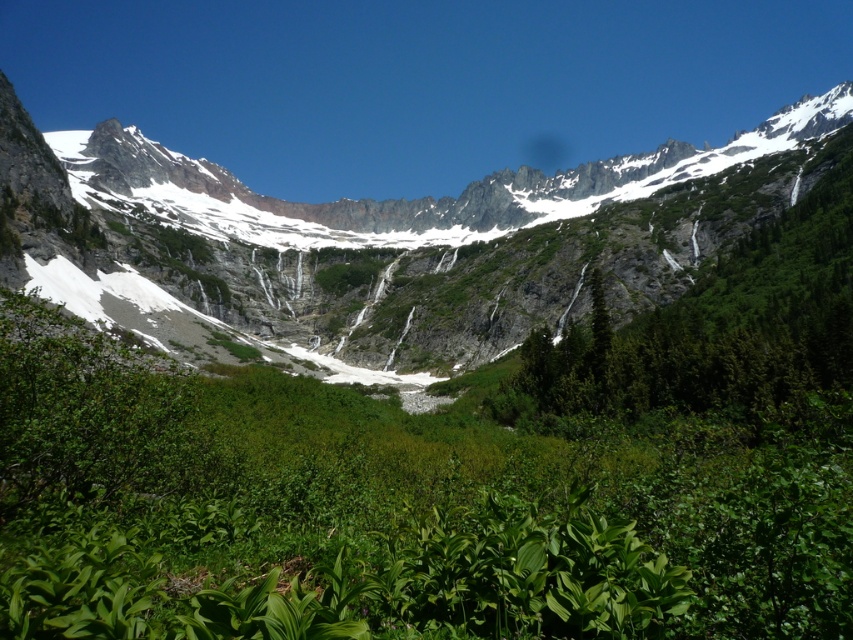
You are an explorer hiking through the mountain. You see the green mossy rock at center and the green leafy tree at upper right. Which object is closer to you?

The green mossy rock at center is closer to you because it is further to the viewer than the green leafy tree at upper right.

You are a hiker planning to take a photo of the green mossy rock at center and the green leafy tree at upper right. Which object should you focus on first if you want both to be in sharp focus?

You should focus on the green mossy rock at center first because it is larger and closer to you than the green leafy tree at upper right, ensuring both will be in focus when using depth of field properly.

You are a hiker who wants to reach the green leafy tree at upper right from the green mossy rock at center. Given that your average walking pace is 1.5 meters per second, how many seconds will it take you to walk directly between the two?

The distance between the green mossy rock at center and the green leafy tree at upper right is 62.96 meters. At a pace of 1.5 meters per second, dividing 62.96 by 1.5 gives approximately 41.97 seconds. Therefore, it will take roughly 42 seconds to walk directly between the two.